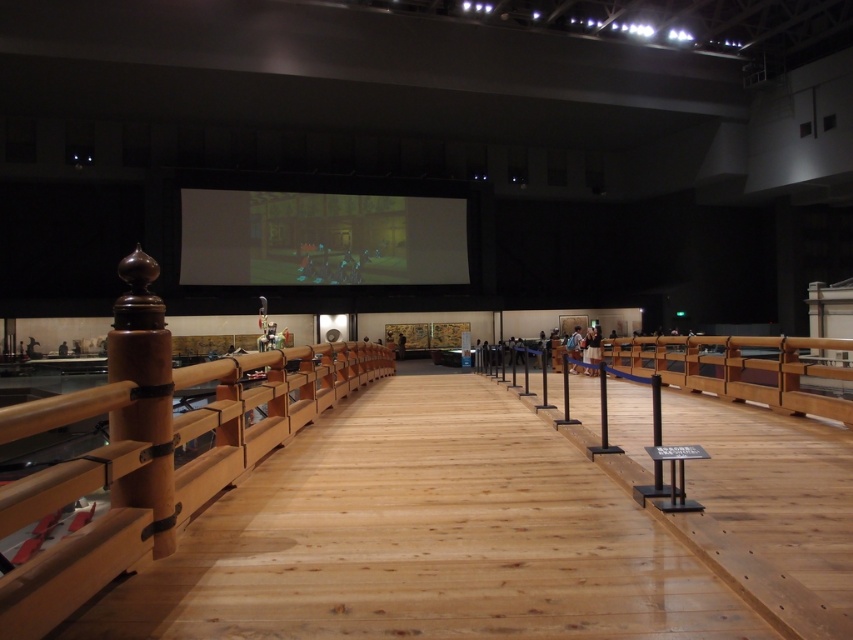
Question: Which point is closer to the camera taking this photo?

Choices:
 (A) (224, 227)
 (B) (389, 355)

Answer: (B)

Question: From the image, what is the correct spatial relationship of natural wood railing at left in relation to matte black screen at center?

Choices:
 (A) above
 (B) below

Answer: (B)

Question: Is natural wood railing at left thinner than matte black screen at center?

Choices:
 (A) no
 (B) yes

Answer: (B)

Question: Which of the following is the farthest from the observer?

Choices:
 (A) (303, 275)
 (B) (180, 428)

Answer: (A)

Question: Does natural wood railing at left appear on the left side of matte black screen at center?

Choices:
 (A) yes
 (B) no

Answer: (B)